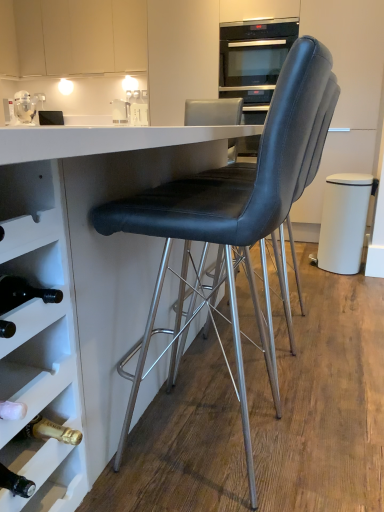
Identify the location of free space that is in between black leather chair at center, the 2th chair in the front-to-back sequence, and white matte trash can at right. This screenshot has height=512, width=384. (327, 290).